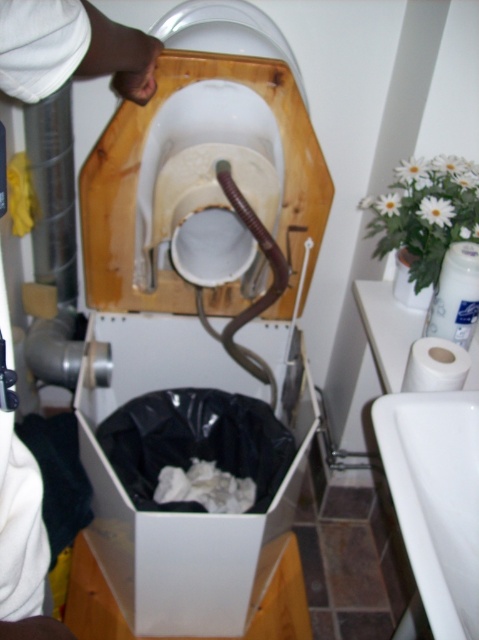
Is white plastic box at lower center taller than white glossy toilet bowl at center?

Yes.

Who is lower down, white plastic box at lower center or white glossy toilet bowl at center?

white plastic box at lower center

Which is in front, point (146, 579) or point (178, 220)?

Point (178, 220)

The height and width of the screenshot is (640, 479). I want to click on white plastic box at lower center, so click(x=180, y=513).

This screenshot has width=479, height=640. What do you see at coordinates (212, 211) in the screenshot?
I see `white glossy toilet bowl at center` at bounding box center [212, 211].

Does white glossy toilet bowl at center have a lesser width compared to white matte toilet paper at lower right?

In fact, white glossy toilet bowl at center might be wider than white matte toilet paper at lower right.

What do you see at coordinates (212, 211) in the screenshot?
I see `white glossy toilet bowl at center` at bounding box center [212, 211].

This screenshot has width=479, height=640. Identify the location of white glossy toilet bowl at center. (212, 211).

Is point (184, 566) in front of point (465, 592)?

That is False.

Consider the image. Is white plastic box at lower center positioned before white glossy sink at lower right?

No, it is behind white glossy sink at lower right.

At what (x,y) coordinates should I click in order to perform the action: click on white plastic box at lower center. Please return your answer as a coordinate pair (x, y). Image resolution: width=479 pixels, height=640 pixels. Looking at the image, I should click on (180, 513).

You are a GUI agent. You are given a task and a screenshot of the screen. Output one action in this format:
    pyautogui.click(x=<x>, y=<y>)
    Task: Click on the white plastic box at lower center
    
    Given the screenshot: What is the action you would take?
    pyautogui.click(x=180, y=513)